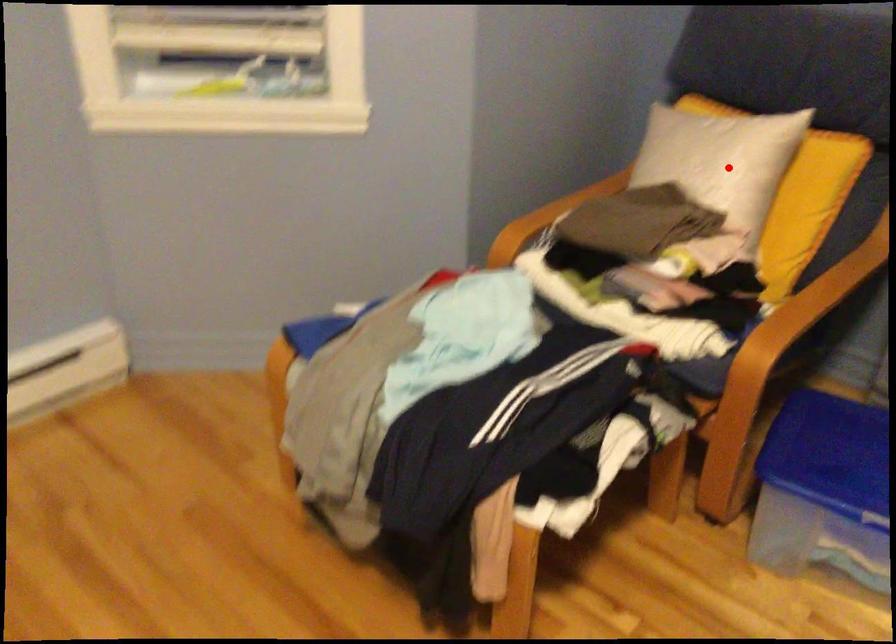
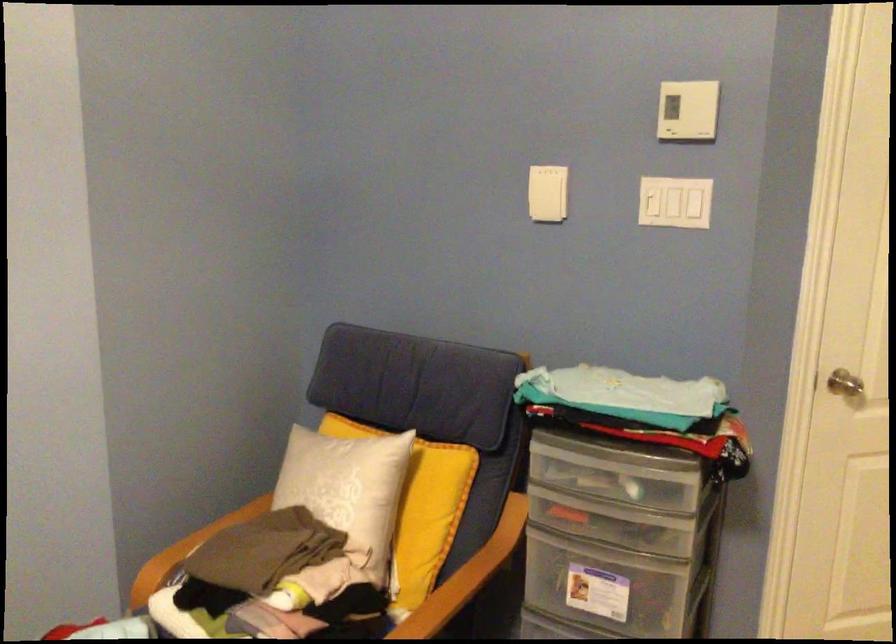
Question: I am providing you with two images of the same scene from different viewpoints. A red point is marked on the first image. Can you still see the location of the red point in image 2?

Choices:
 (A) Yes
 (B) No

Answer: (A)